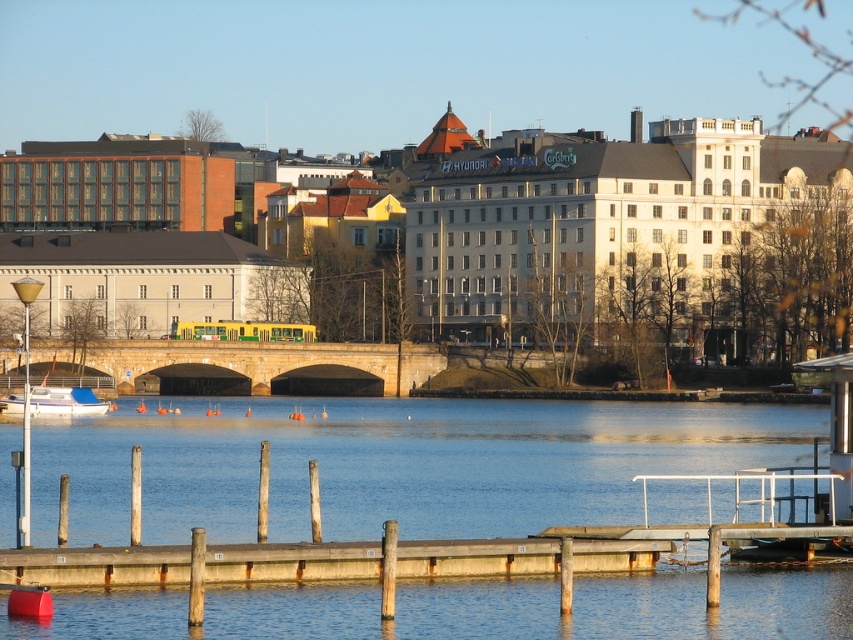
Question: Which point is closer to the camera taking this photo?

Choices:
 (A) (660, 545)
 (B) (19, 417)
 (C) (506, 509)

Answer: (A)

Question: Is blue water at lower center smaller than wooden dock at lower center?

Choices:
 (A) yes
 (B) no

Answer: (B)

Question: Is wooden dock at lower center wider than white matte boat at lower left?

Choices:
 (A) no
 (B) yes

Answer: (B)

Question: Does wooden dock at lower center have a lesser width compared to white matte boat at lower left?

Choices:
 (A) yes
 (B) no

Answer: (B)

Question: Which of the following is the closest to the observer?

Choices:
 (A) wooden dock at lower center
 (B) blue water at lower center

Answer: (A)

Question: Which point is closer to the camera taking this photo?

Choices:
 (A) (583, 468)
 (B) (67, 412)

Answer: (A)